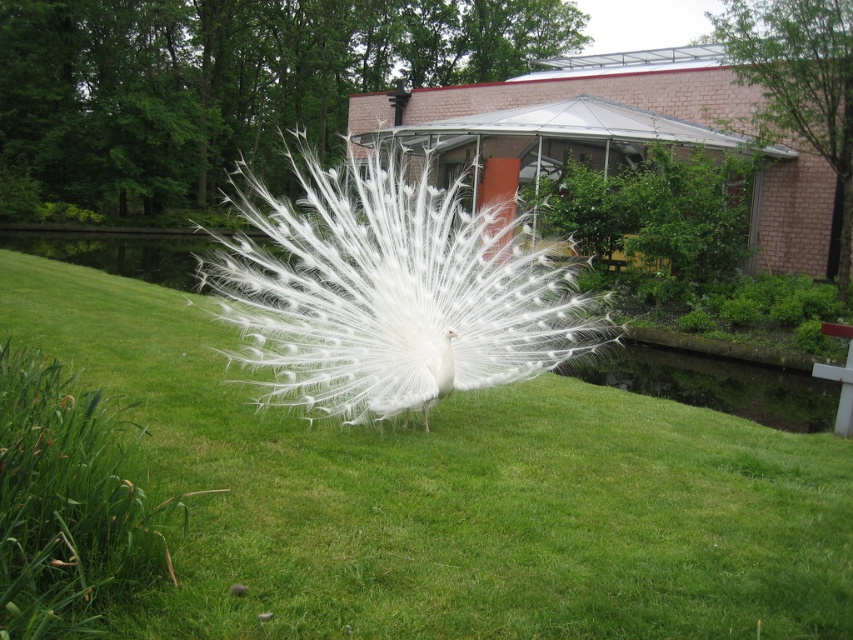
Question: Can you confirm if green grassy at center is wider than white feathered peacock at center?

Choices:
 (A) yes
 (B) no

Answer: (B)

Question: Which point is farther to the camera?

Choices:
 (A) green grassy at center
 (B) white feathered peacock at center

Answer: (B)

Question: Can you confirm if green grassy at center is bigger than white feathered peacock at center?

Choices:
 (A) no
 (B) yes

Answer: (A)

Question: Does green grassy at center appear over white feathered peacock at center?

Choices:
 (A) yes
 (B) no

Answer: (B)

Question: Which object is closer to the camera taking this photo?

Choices:
 (A) white feathered peacock at center
 (B) green grassy at center

Answer: (B)

Question: Which of the following is the closest to the observer?

Choices:
 (A) green grassy at center
 (B) white feathered peacock at center

Answer: (A)